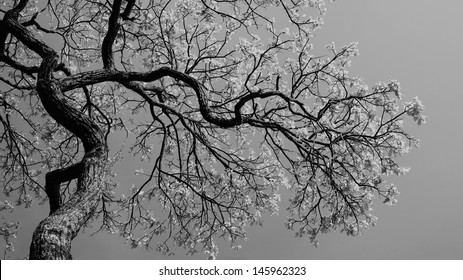
Locate an element on the screen. Image resolution: width=463 pixels, height=280 pixels. white bottom border is located at coordinates (37, 267), (140, 271), (334, 268), (423, 271).